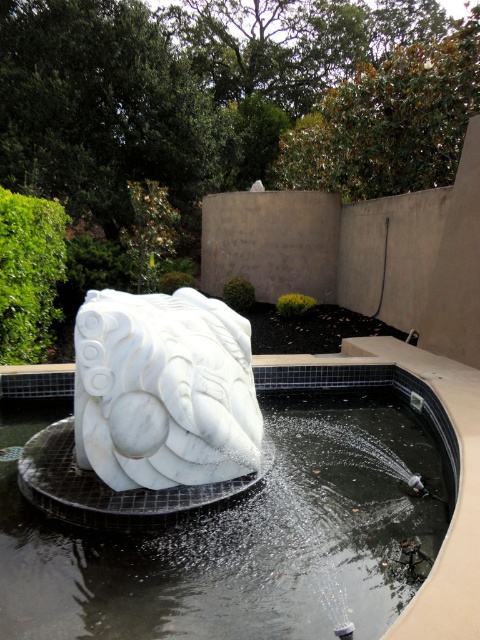
You are a maintenance worker who needs to clean the white marble fountain at center and the white marble sculpture at center. You have a 24 inch long cleaning tool. Can you reach both objects without moving your position?

The white marble fountain at center is 28.42 inches away from the white marble sculpture at center. Since the tool is only 24 inches long, you cannot reach both objects without moving your position because the distance between them exceeds the tool length.